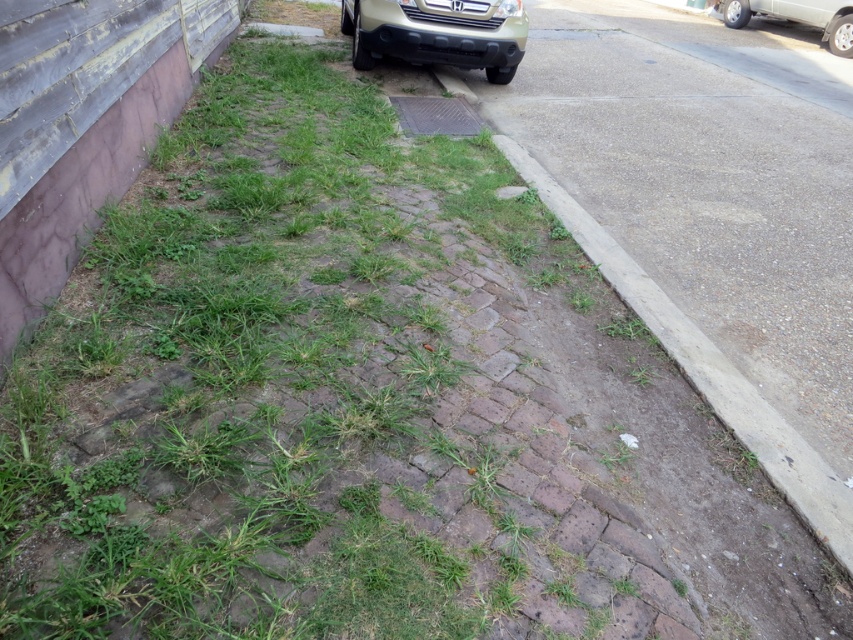
You are a delivery person trying to park your vehicle between the gold matte bumper at upper center and the metallic grid cover at center. Based on their positions, which object should you avoid hitting when backing up?

The gold matte bumper at upper center is positioned over the metallic grid cover at center, so when backing up, you should avoid hitting the gold matte bumper at upper center first as it is closer to your vehicle.